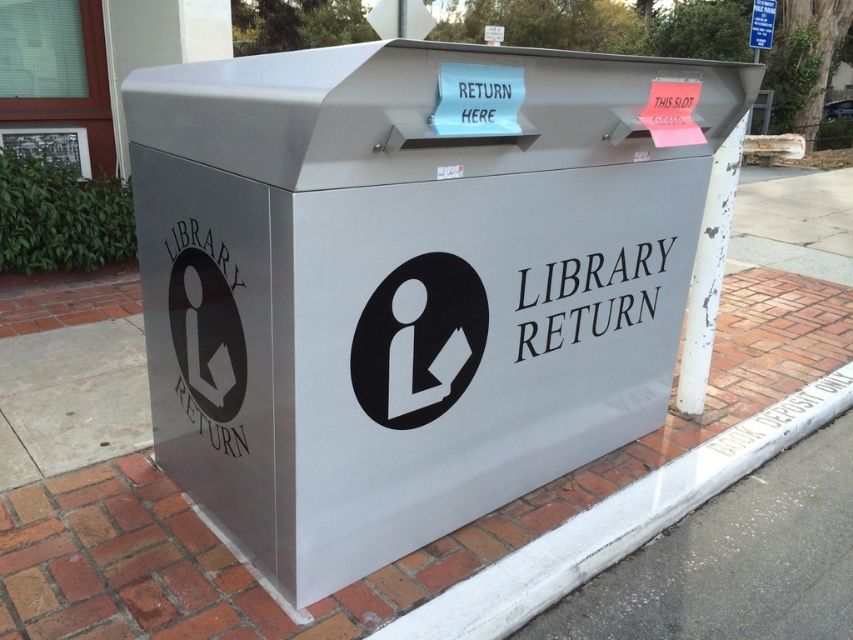
Is point (213, 317) positioned before point (752, 19)?

Yes, it is in front of point (752, 19).

Locate an element on the screen. black matte logo at lower left is located at coordinates click(206, 333).

Does black matte logo at center come behind black matte logo at lower left?

That is False.

What do you see at coordinates (418, 333) in the screenshot? The image size is (853, 640). I see `black matte logo at center` at bounding box center [418, 333].

Does point (431, 353) come closer to viewer compared to point (219, 250)?

No, (431, 353) is further to viewer.

You are a GUI agent. You are given a task and a screenshot of the screen. Output one action in this format:
    pyautogui.click(x=<x>, y=<y>)
    Task: Click on the black matte logo at center
    The image size is (853, 640).
    Given the screenshot: What is the action you would take?
    pyautogui.click(x=418, y=333)

The image size is (853, 640). Identify the location of metallic gray library return box at center. (410, 280).

Which is behind, point (270, 522) or point (769, 22)?

The point (769, 22) is more distant.

Is point (302, 54) positioned behind point (759, 28)?

No, it is not.

This screenshot has height=640, width=853. Identify the location of metallic gray library return box at center. (410, 280).